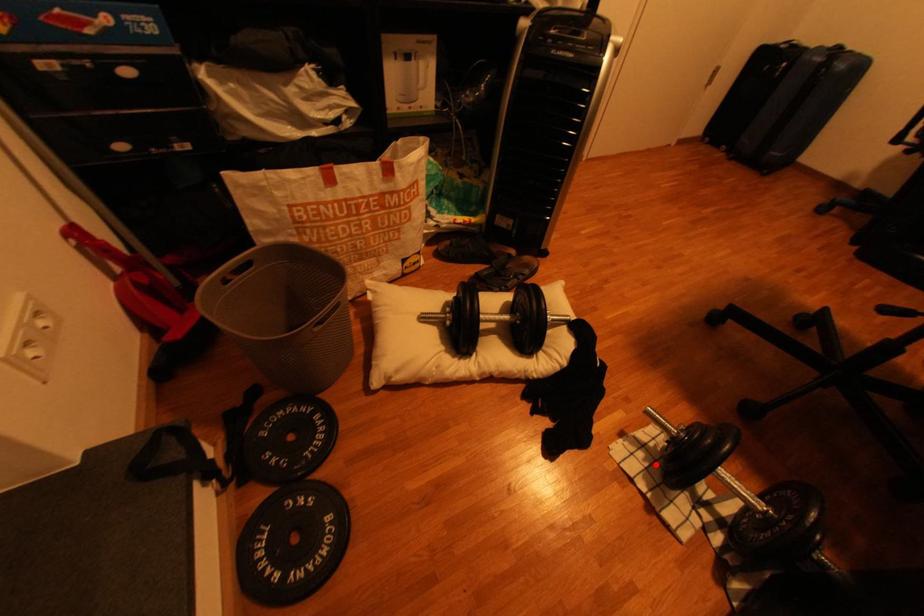
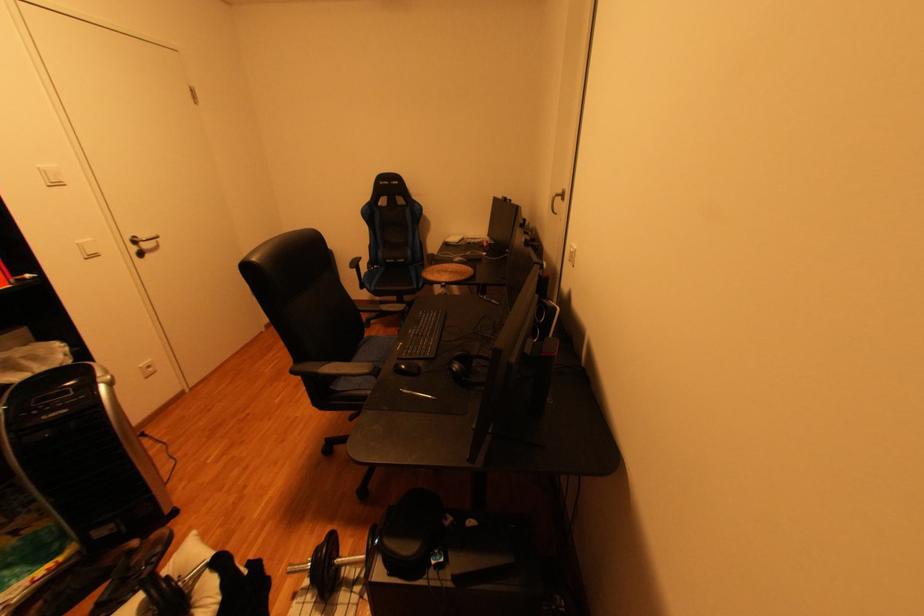
In the second image, find the point that corresponds to the highlighted location in the first image.

(323, 600)